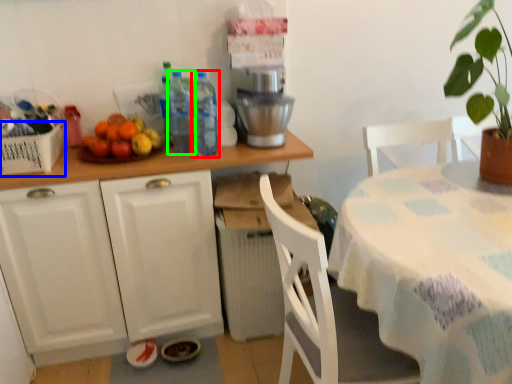
Question: Which object is positioned farthest from bottle (highlighted by a red box)? Select from basket (highlighted by a blue box) and bottle (highlighted by a green box).

Choices:
 (A) basket
 (B) bottle

Answer: (A)